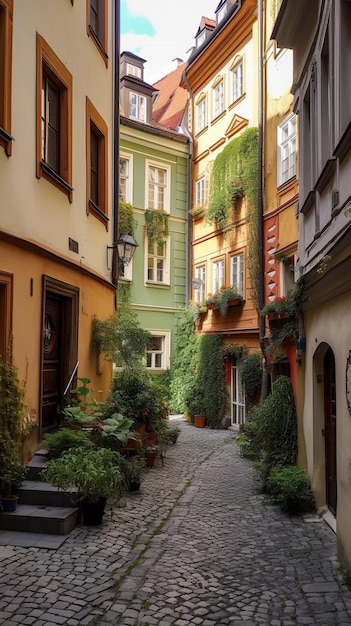
Where is `door`? The width and height of the screenshot is (351, 626). door is located at coordinates pyautogui.click(x=53, y=349), pyautogui.click(x=324, y=417).